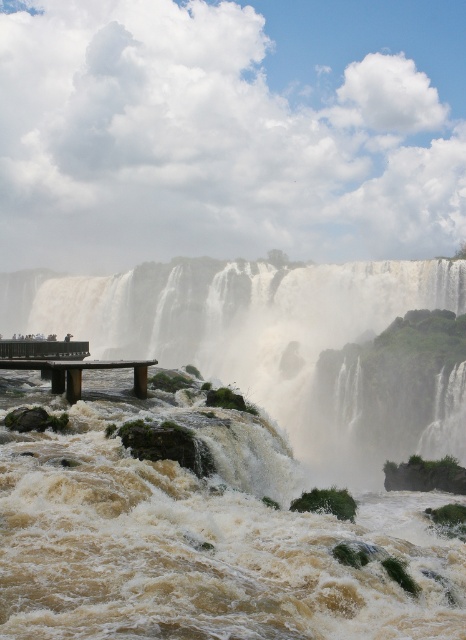
In the scene shown: Can you confirm if white frothy water at left is positioned above metallic silver bench at lower left?

Yes.

Between white frothy water at left and metallic silver bench at lower left, which one has more height?

white frothy water at left

Describe the element at coordinates (286, 344) in the screenshot. I see `white frothy water at left` at that location.

Where is `white frothy water at left`? Image resolution: width=466 pixels, height=640 pixels. white frothy water at left is located at coordinates (286, 344).

Which is above, brown frothy water at center or metallic silver bench at lower left?

metallic silver bench at lower left is above.

Does point (129, 403) come farther from viewer compared to point (69, 401)?

Yes, point (129, 403) is behind point (69, 401).

The width and height of the screenshot is (466, 640). In order to click on brown frothy water at center in this screenshot , I will do `click(198, 532)`.

Is metallic silver bench at lower left bigger than brown wooden bench at lower left?

Incorrect, metallic silver bench at lower left is not larger than brown wooden bench at lower left.

Is metallic silver bench at lower left to the left of brown wooden bench at lower left from the viewer's perspective?

No, metallic silver bench at lower left is not to the left of brown wooden bench at lower left.

Where is `metallic silver bench at lower left`? The height and width of the screenshot is (640, 466). metallic silver bench at lower left is located at coordinates (90, 369).

Identify the location of metallic silver bench at lower left. (90, 369).